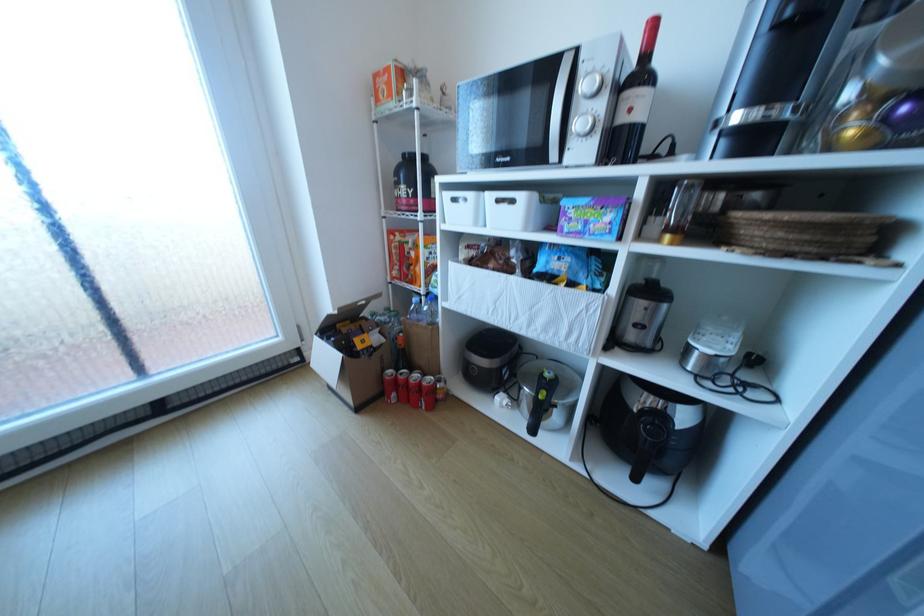
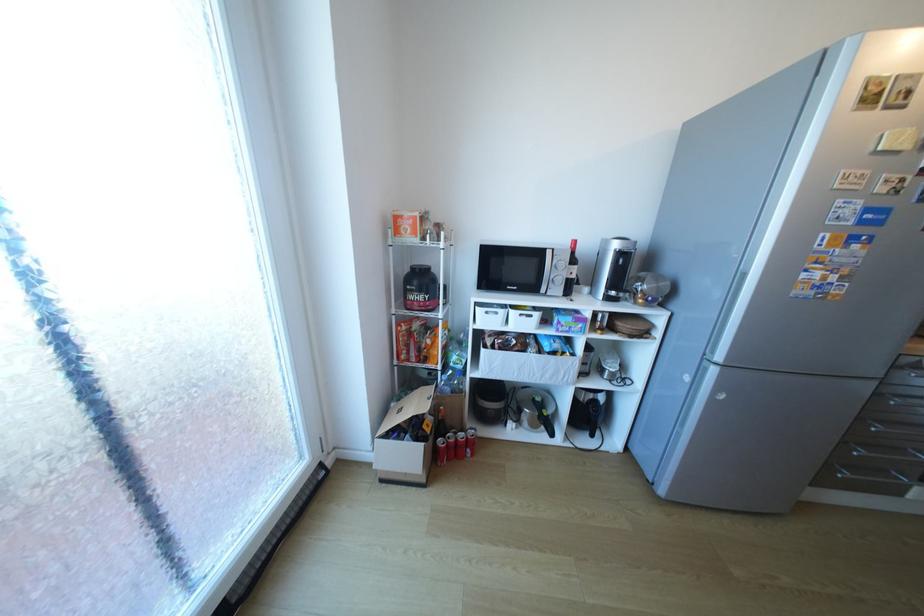
The point at (650,426) is marked in the first image. Where is the corresponding point in the second image?

(600, 408)